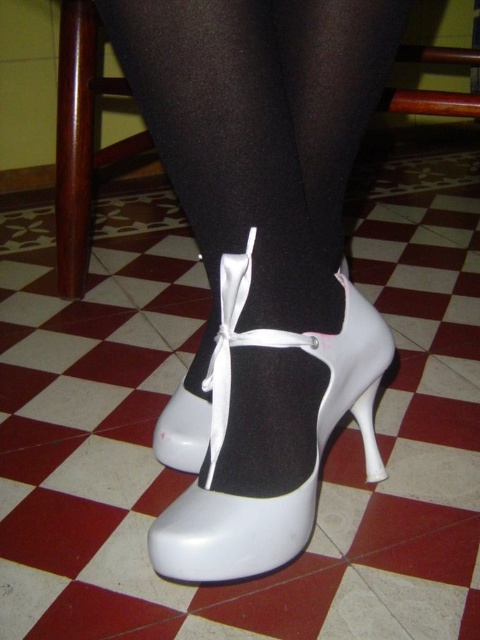
Can you confirm if white satin shoe at center is positioned above white matte heel at lower center?

Yes.

Who is positioned more to the right, white satin shoe at center or white matte heel at lower center?

white matte heel at lower center

Between point (348, 35) and point (377, 477), which one is positioned behind?

Positioned behind is point (377, 477).

Locate an element on the screen. white satin shoe at center is located at coordinates (255, 150).

Can you confirm if white matte high-heeled shoe at center is wider than white matte heel at lower center?

Correct, the width of white matte high-heeled shoe at center exceeds that of white matte heel at lower center.

Who is more forward, (351, 365) or (370, 467)?

Positioned in front is point (351, 365).

Identify the location of white matte high-heeled shoe at center. (226, 433).

What do you see at coordinates (255, 150) in the screenshot?
I see `white satin shoe at center` at bounding box center [255, 150].

Does white satin shoe at center have a lesser width compared to white matte high-heeled shoe at center?

Yes.

You are a GUI agent. You are given a task and a screenshot of the screen. Output one action in this format:
    pyautogui.click(x=<x>, y=<y>)
    Task: Click on the white satin shoe at center
    This screenshot has width=480, height=640.
    Given the screenshot: What is the action you would take?
    pyautogui.click(x=255, y=150)

In order to click on white satin shoe at center in this screenshot , I will do `click(255, 150)`.